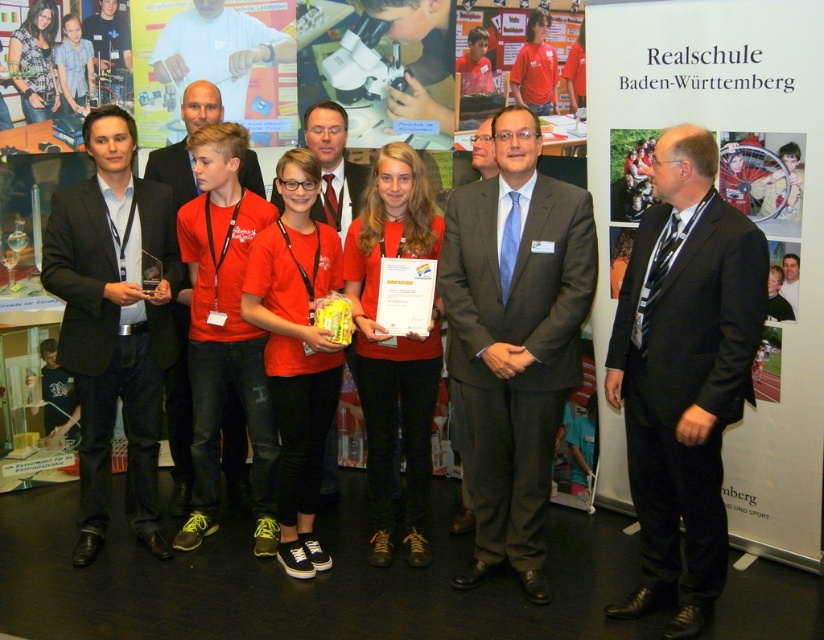
Is dark gray suit at center thinner than matte black suit at left?

No.

Who is more distant from viewer, (494, 547) or (118, 282)?

Positioned behind is point (118, 282).

The image size is (824, 640). I want to click on dark gray suit at center, so [515, 337].

Which is more to the right, matte red shirt at center or smooth white shirt at upper center?

smooth white shirt at upper center

Which is behind, point (185, 358) or point (223, 32)?

The point (223, 32) is behind.

The width and height of the screenshot is (824, 640). Identify the location of matte red shirt at center. (180, 410).

In the scene shown: Between dark gray suit at center and matte red shirt at center, which one is positioned higher?

Positioned higher is dark gray suit at center.

Is point (462, 280) positioned in front of point (190, 88)?

Yes, point (462, 280) is closer to viewer.

Does point (495, 362) come behind point (172, 458)?

No, it is not.

Where is `dark gray suit at center`? dark gray suit at center is located at coordinates (515, 337).